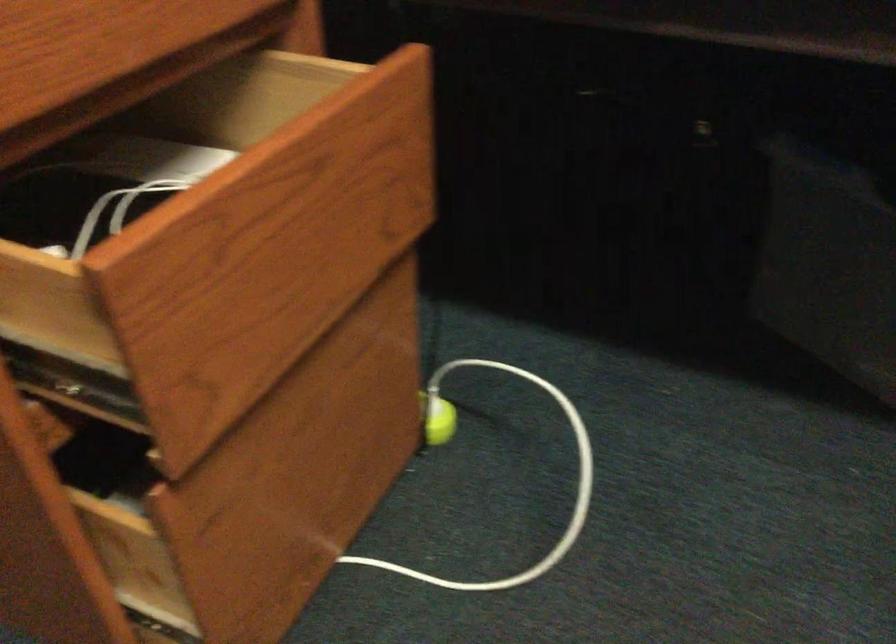
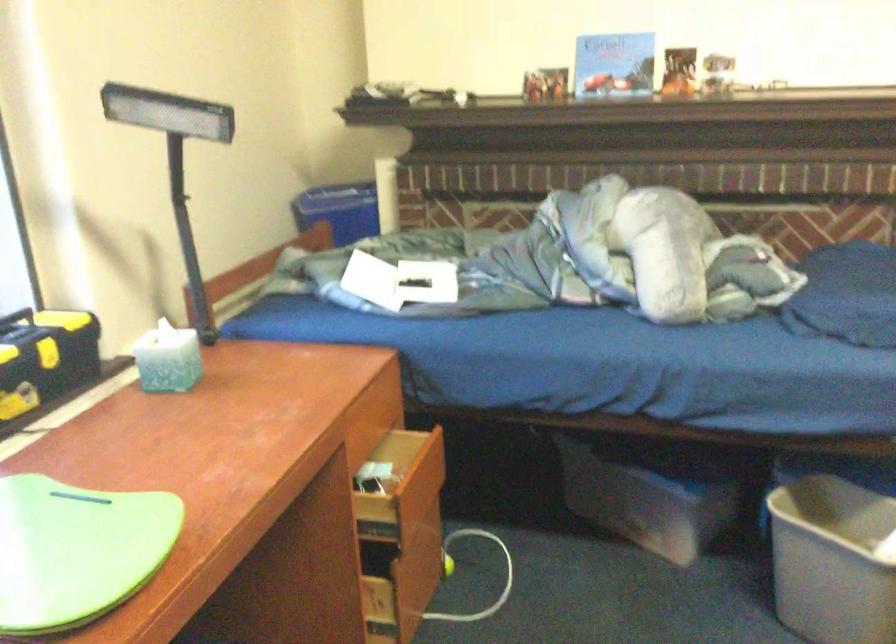
Question: What movement of the cameraman would produce the second image?

Choices:
 (A) Left
 (B) Right
 (C) Forward
 (D) Backward

Answer: (D)